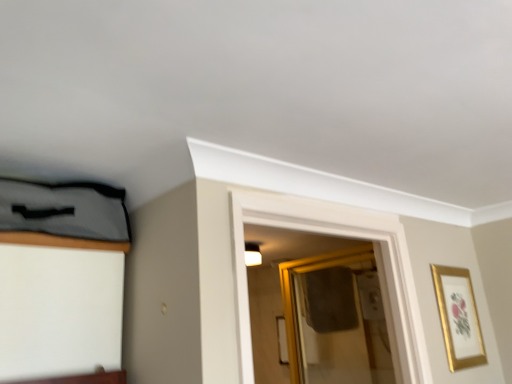
Locate an element on the screen. gold-framed mirror at center is located at coordinates (335, 319).

The width and height of the screenshot is (512, 384). Describe the element at coordinates (335, 319) in the screenshot. I see `gold-framed mirror at center` at that location.

What do you see at coordinates (458, 317) in the screenshot? The height and width of the screenshot is (384, 512). I see `gold metallic picture frame at upper right` at bounding box center [458, 317].

Identify the location of gold metallic picture frame at upper right. Image resolution: width=512 pixels, height=384 pixels. (458, 317).

Locate an element on the screen. gold-framed mirror at center is located at coordinates (335, 319).

Is gold metallic picture frame at upper right at the left side of gold-framed mirror at center?

No.

Is gold metallic picture frame at upper right positioned behind gold-framed mirror at center?

No, it is not.

Between point (450, 283) and point (326, 269), which one is positioned behind?

The point (326, 269) is behind.

From the image's perspective, is gold metallic picture frame at upper right on gold-framed mirror at center?

Yes, from the image's perspective, gold metallic picture frame at upper right is on top of gold-framed mirror at center.

From a real-world perspective, is gold metallic picture frame at upper right positioned under gold-framed mirror at center based on gravity?

Yes, from a real-world perspective, gold metallic picture frame at upper right is beneath gold-framed mirror at center.

Is gold metallic picture frame at upper right thinner than gold-framed mirror at center?

Indeed, gold metallic picture frame at upper right has a lesser width compared to gold-framed mirror at center.

Does gold metallic picture frame at upper right have a lesser height compared to gold-framed mirror at center?

Yes.

Who is bigger, gold metallic picture frame at upper right or gold-framed mirror at center?

With larger size is gold-framed mirror at center.

Can we say gold metallic picture frame at upper right lies outside gold-framed mirror at center?

Indeed, gold metallic picture frame at upper right is completely outside gold-framed mirror at center.

Is gold metallic picture frame at upper right next to gold-framed mirror at center and touching it?

No, gold metallic picture frame at upper right is not touching gold-framed mirror at center.

Is gold metallic picture frame at upper right oriented away from gold-framed mirror at center?

Correct, gold metallic picture frame at upper right is looking away from gold-framed mirror at center.

What's the angular difference between gold metallic picture frame at upper right and gold-framed mirror at center's facing directions?

The facing directions of gold metallic picture frame at upper right and gold-framed mirror at center are 89.6 degrees apart.

Measure the distance between gold metallic picture frame at upper right and gold-framed mirror at center.

gold metallic picture frame at upper right is 64.33 centimeters away from gold-framed mirror at center.

I want to click on picture frame above the gold-framed mirror at center (from the image's perspective), so click(458, 317).

Based on their positions, is gold-framed mirror at center located to the left or right of gold metallic picture frame at upper right?

In the image, gold-framed mirror at center appears on the left side of gold metallic picture frame at upper right.

Based on the photo, between gold-framed mirror at center and gold metallic picture frame at upper right, which one is positioned behind?

gold-framed mirror at center is more distant.

Considering the positions of point (373, 310) and point (445, 344), is point (373, 310) closer or farther from the camera than point (445, 344)?

Point (373, 310).

From the image's perspective, which one is positioned higher, gold-framed mirror at center or gold metallic picture frame at upper right?

gold metallic picture frame at upper right is shown above in the image.

From a real-world perspective, is gold-framed mirror at center below gold metallic picture frame at upper right?

No.

Looking at this image, does gold-framed mirror at center have a lesser width compared to gold metallic picture frame at upper right?

In fact, gold-framed mirror at center might be wider than gold metallic picture frame at upper right.

From their relative heights in the image, would you say gold-framed mirror at center is taller or shorter than gold metallic picture frame at upper right?

gold-framed mirror at center is taller than gold metallic picture frame at upper right.

Is gold-framed mirror at center smaller than gold metallic picture frame at upper right?

Actually, gold-framed mirror at center might be larger than gold metallic picture frame at upper right.

Is gold-framed mirror at center completely or partially outside of gold metallic picture frame at upper right?

Yes, gold-framed mirror at center is located beyond the bounds of gold metallic picture frame at upper right.

Would you consider gold-framed mirror at center to be distant from gold metallic picture frame at upper right?

Actually, gold-framed mirror at center and gold metallic picture frame at upper right are a little close together.

Does gold-framed mirror at center turn towards gold metallic picture frame at upper right?

No, gold-framed mirror at center is not oriented towards gold metallic picture frame at upper right.

In the scene shown: How different are the orientations of gold-framed mirror at center and gold metallic picture frame at upper right in degrees?

gold-framed mirror at center and gold metallic picture frame at upper right are facing 89.6 degrees away from each other.

In the image, there is a gold-framed mirror at center. Where is `picture frame above it (from the image's perspective)`? The image size is (512, 384). picture frame above it (from the image's perspective) is located at coordinates (458, 317).

This screenshot has height=384, width=512. In order to click on glass door on the left of gold metallic picture frame at upper right in this screenshot , I will do `click(335, 319)`.

Image resolution: width=512 pixels, height=384 pixels. There is a gold metallic picture frame at upper right. What are the coordinates of `glass door above it (from a real-world perspective)` in the screenshot? It's located at (335, 319).